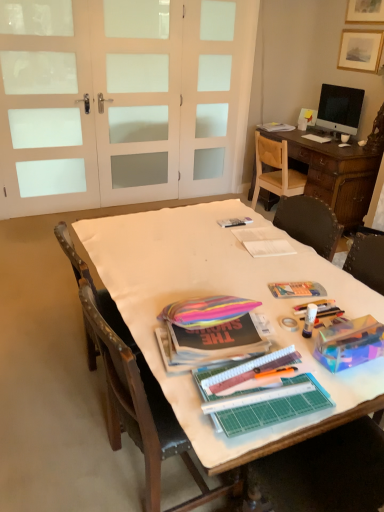
The image size is (384, 512). I want to click on free space above white paper at center (from a real-world perspective), so tap(321, 131).